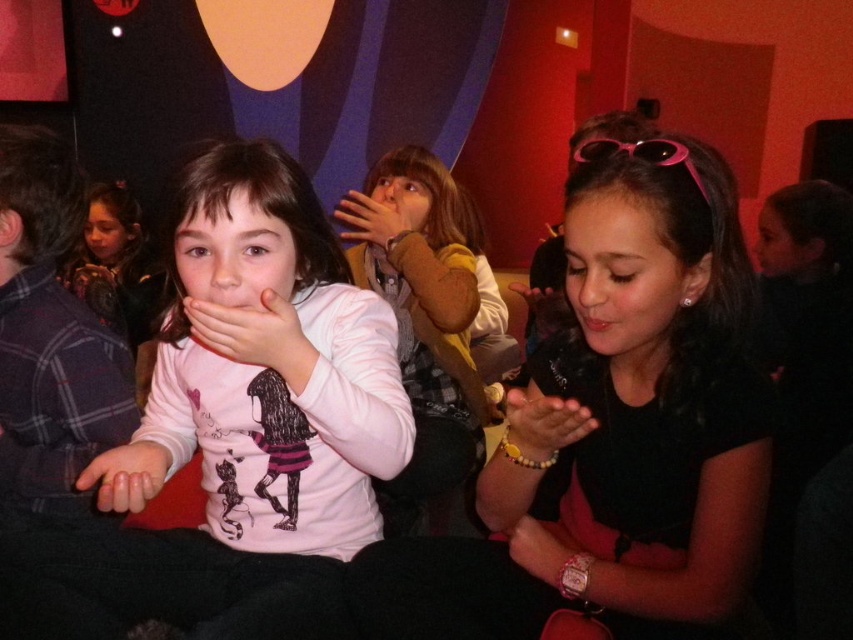
Is smooth beige hand at center taller than matte black bracelet at lower center?

Yes.

This screenshot has width=853, height=640. What are the coordinates of `smooth beige hand at center` in the screenshot? It's located at (543, 422).

Consider the image. Can you confirm if smooth beige hand at center is positioned to the left of matte black hand at center?

In fact, smooth beige hand at center is to the right of matte black hand at center.

Does smooth beige hand at center have a lesser height compared to matte black hand at center?

Indeed, smooth beige hand at center has a lesser height compared to matte black hand at center.

Where is `smooth beige hand at center`? This screenshot has width=853, height=640. smooth beige hand at center is located at coordinates (543, 422).

Locate an element on the screen. The width and height of the screenshot is (853, 640). smooth beige hand at center is located at coordinates (543, 422).

Which is more to the left, matte brown sweater at center or matte black hand at center?

From the viewer's perspective, matte black hand at center appears more on the left side.

Who is higher up, matte brown sweater at center or matte black hand at center?

matte black hand at center

At what (x,y) coordinates should I click in order to perform the action: click on matte brown sweater at center. Please return your answer as a coordinate pair (x, y). Looking at the image, I should click on (422, 324).